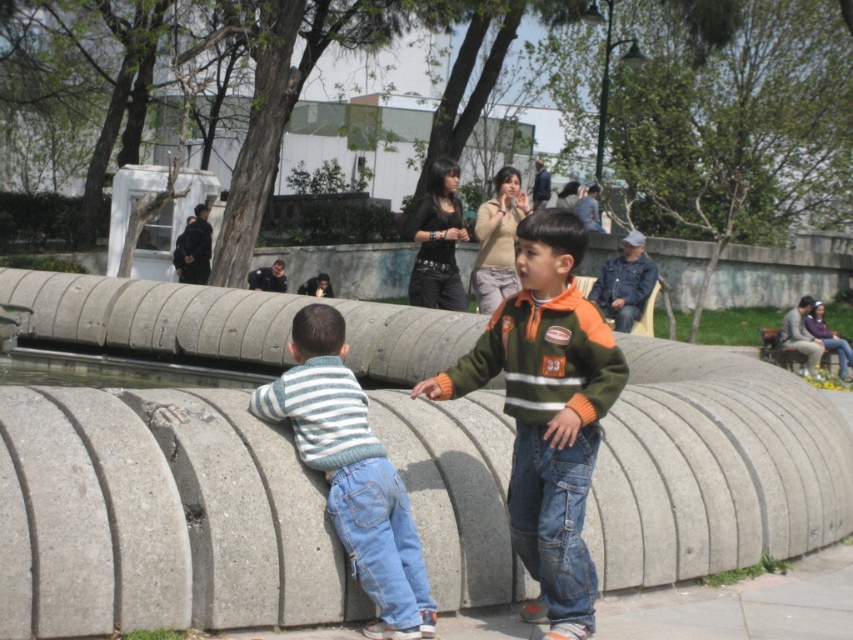
You are a photographer setting up a shot of the gray concrete at center and the striped knit sweater at left. If you want to emphasize the size difference between them, which object should you position closer to the camera?

To emphasize the size difference between the gray concrete at center and the striped knit sweater at left, you should position the gray concrete at center closer to the camera since its width is larger than the striped knit sweater at left.

Looking at this image, you are standing at the center of the park and want to find the gray concrete at center. According to the coordinates provided, in which direction should you look to locate it?

The gray concrete at center is located at coordinates point (158, 516), so you should look to the lower right direction from the center to locate it.